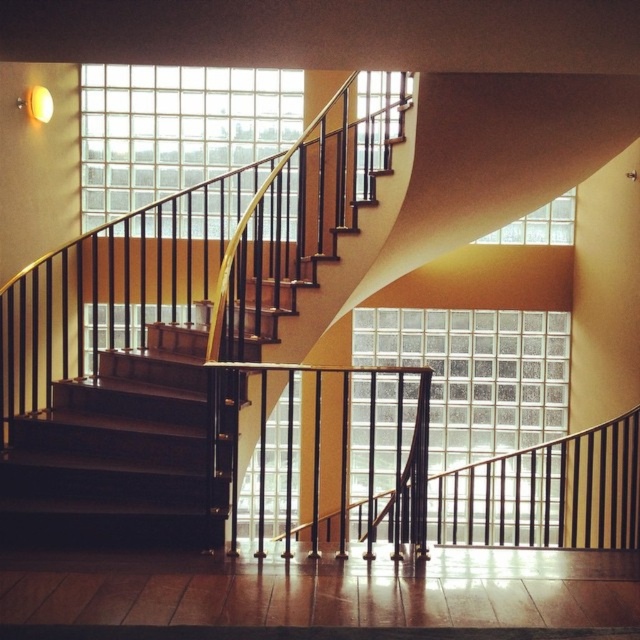
Which is more to the left, dark brown wooden stairs at lower left or clear glass wall at upper center?

From the viewer's perspective, clear glass wall at upper center appears more on the left side.

Does dark brown wooden stairs at lower left have a lesser width compared to clear glass wall at upper center?

Correct, dark brown wooden stairs at lower left's width is less than clear glass wall at upper center's.

Image resolution: width=640 pixels, height=640 pixels. I want to click on dark brown wooden stairs at lower left, so click(x=116, y=454).

This screenshot has height=640, width=640. Describe the element at coordinates (116, 454) in the screenshot. I see `dark brown wooden stairs at lower left` at that location.

I want to click on dark brown wooden stairs at lower left, so click(x=116, y=454).

Where is `dark brown wooden stairs at lower left`? Image resolution: width=640 pixels, height=640 pixels. dark brown wooden stairs at lower left is located at coordinates (116, 454).

Does dark brown wooden stairs at lower left have a smaller size compared to clear glass wall at center?

Indeed, dark brown wooden stairs at lower left has a smaller size compared to clear glass wall at center.

The width and height of the screenshot is (640, 640). What do you see at coordinates (116, 454) in the screenshot?
I see `dark brown wooden stairs at lower left` at bounding box center [116, 454].

Who is more distant from viewer, (182,424) or (563,321)?

Positioned behind is point (563,321).

Where is `dark brown wooden stairs at lower left`? dark brown wooden stairs at lower left is located at coordinates (116, 454).